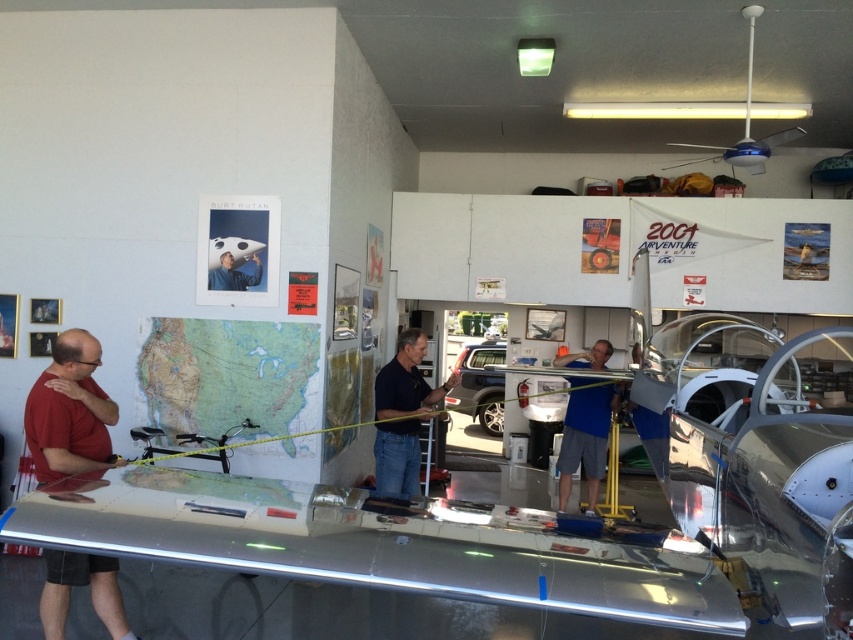
Question: In this image, where is red matte shirt at left located relative to blue fabric shirt at center?

Choices:
 (A) left
 (B) right

Answer: (A)

Question: Does black matte shirt at center appear over blue fabric shirt at center?

Choices:
 (A) no
 (B) yes

Answer: (B)

Question: From the image, what is the correct spatial relationship of black matte shirt at center in relation to matte black airplane at center?

Choices:
 (A) below
 (B) above

Answer: (A)

Question: Which of the following is the closest to the observer?

Choices:
 (A) blue fabric shirt at center
 (B) red matte shirt at left
 (C) matte black airplane at center

Answer: (B)

Question: Which point appears closest to the camera in this image?

Choices:
 (A) (395, 444)
 (B) (93, 605)

Answer: (B)

Question: Which is farther from the matte black airplane at center?

Choices:
 (A) blue fabric shirt at center
 (B) red matte shirt at left

Answer: (A)